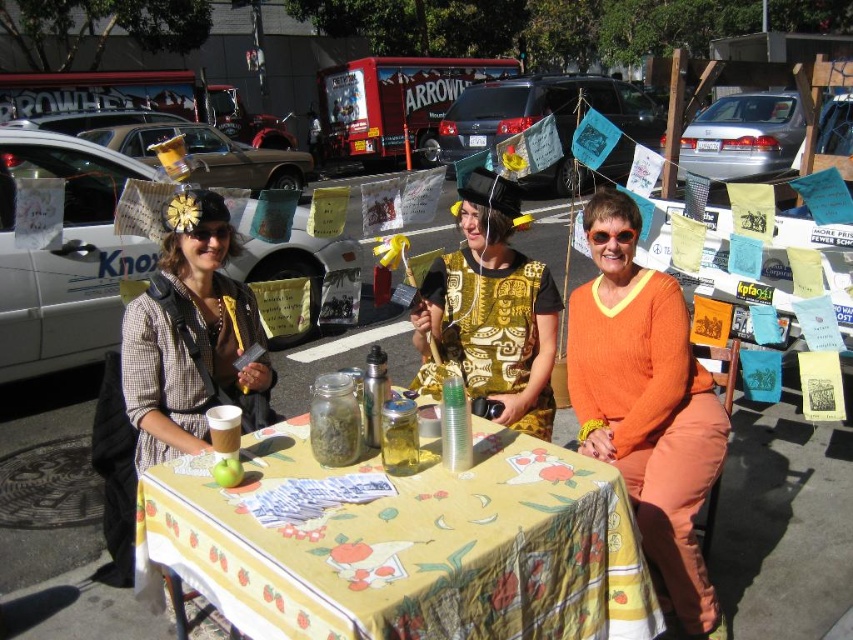
You are a photographer trying to capture the orange ribbed sweater at center and the plaid fabric jacket at center in the same frame. Which one is positioned lower in the image?

The orange ribbed sweater at center is positioned below the plaid fabric jacket at center, so it is lower in the image.

In the scene shown: You are a guest at this event and want to grab the matte plastic cup at table center. However, there is a plaid fabric jacket at center in the way. Can you reach the cup without moving the jacket?

The plaid fabric jacket at center is positioned over the matte plastic cup at table center, so you cannot reach the cup without moving the jacket.